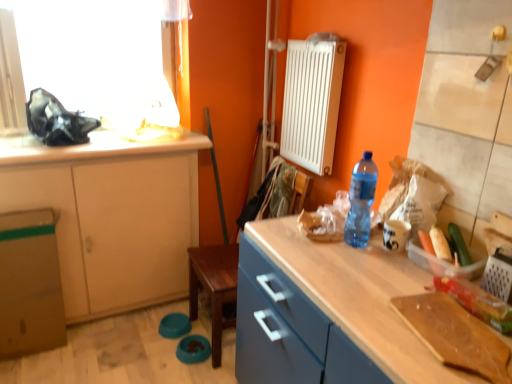
In order to click on free space below wooden cutting board at lower right (from a real-world perspective) in this screenshot , I will do coord(456,339).